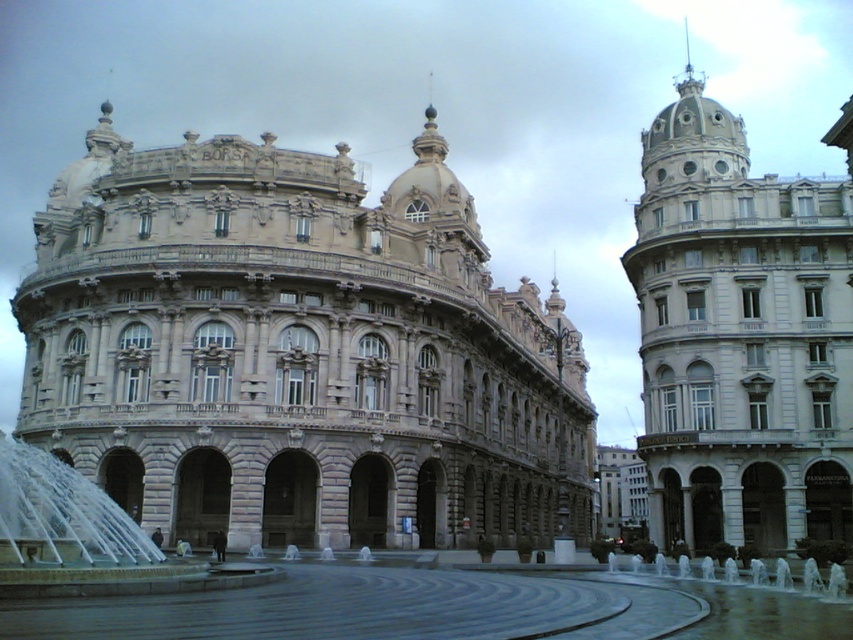
Who is more distant from viewer, [206,257] or [119,577]?

The point [206,257] is more distant.

Based on the photo, does beige stone building at center have a larger size compared to clear glass water at center?

Correct, beige stone building at center is larger in size than clear glass water at center.

Measure the distance between beige stone building at center and camera.

beige stone building at center and camera are 62.42 meters apart from each other.

The width and height of the screenshot is (853, 640). I want to click on beige stone building at center, so click(x=297, y=352).

Is beige stone building at center taller than white stone tower at upper right?

No.

This screenshot has height=640, width=853. I want to click on beige stone building at center, so [x=297, y=352].

Does white stone tower at upper right appear over clear glass water at center?

Correct, white stone tower at upper right is located above clear glass water at center.

Locate an element on the screen. Image resolution: width=853 pixels, height=640 pixels. white stone tower at upper right is located at coordinates (741, 336).

What do you see at coordinates (741, 336) in the screenshot?
I see `white stone tower at upper right` at bounding box center [741, 336].

Identify the location of white stone tower at upper right. (741, 336).